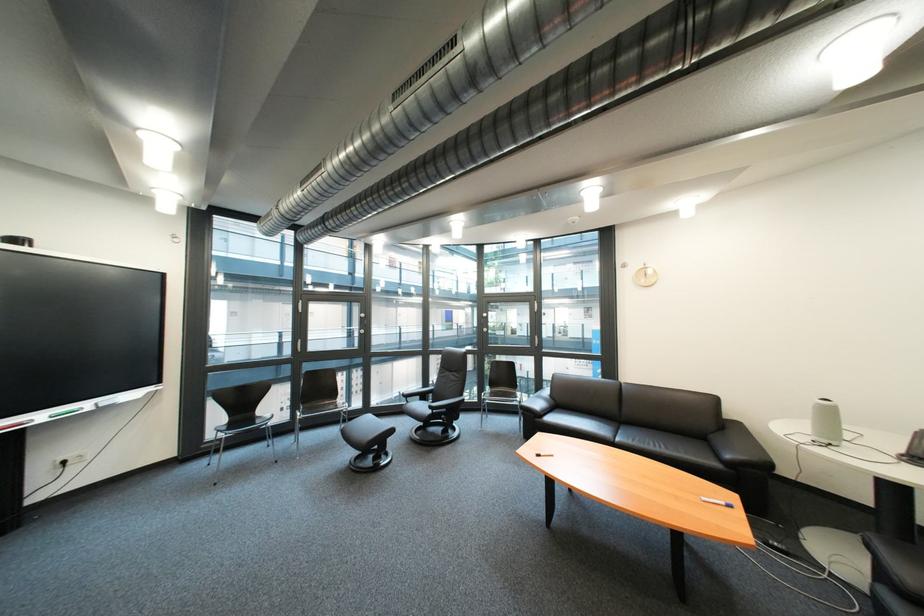
Identify the location of black sofa armrest. This screenshot has width=924, height=616. (738, 447).